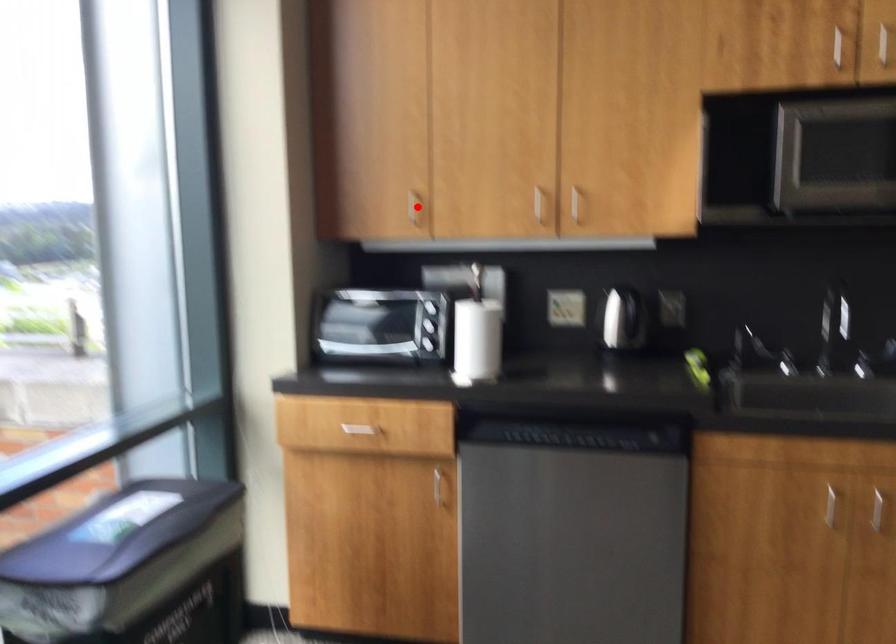
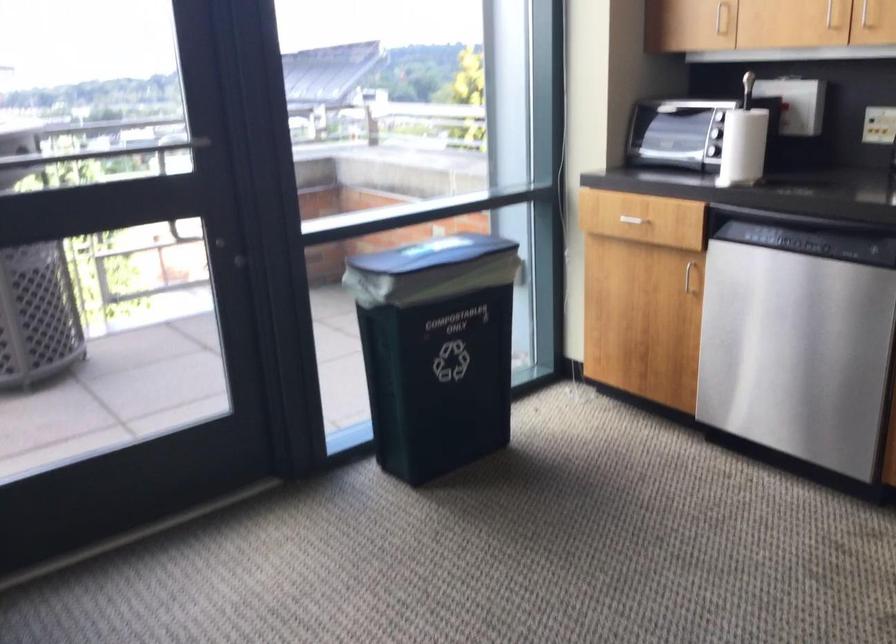
Where in the second image is the point corresponding to the highlighted location from the first image?

(721, 17)